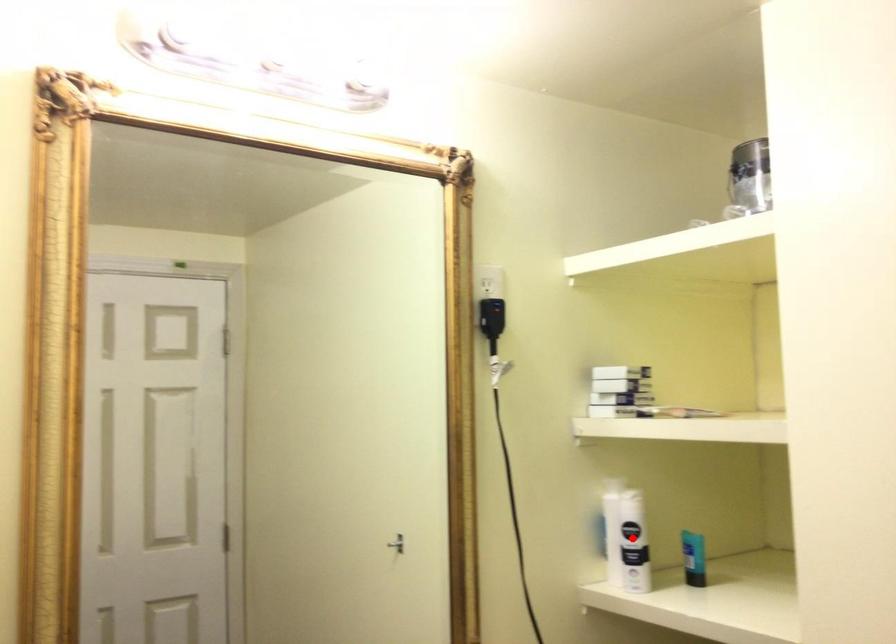
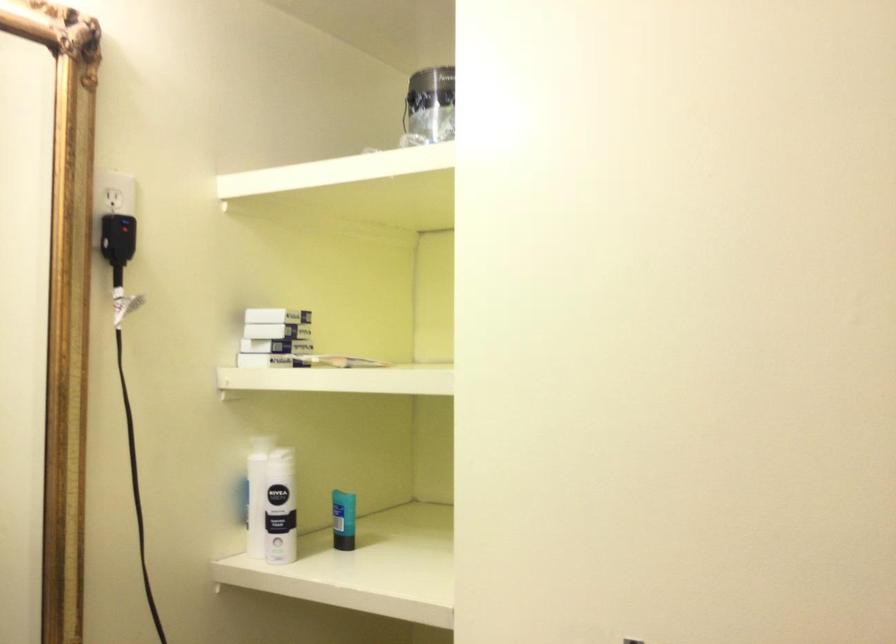
Question: I am providing you with two images of the same scene from different viewpoints. In image1, a red point is highlighted. Considering the same 3D point in image2, which of the following is correct?

Choices:
 (A) It is closer
 (B) It is farther

Answer: (A)